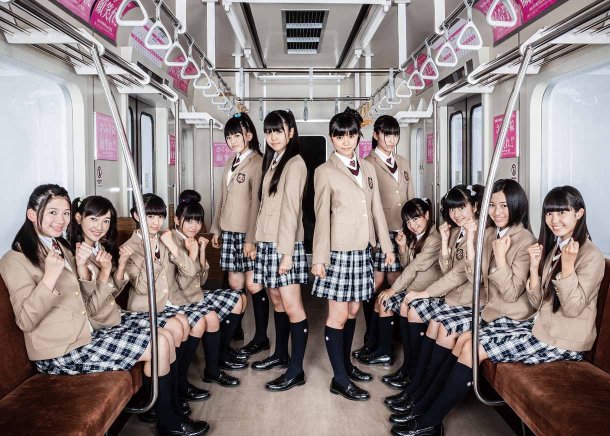
Where is `door`? Image resolution: width=610 pixels, height=436 pixels. door is located at coordinates (314, 149), (465, 135).